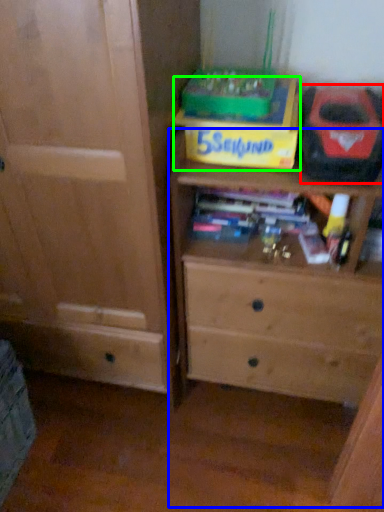
Question: Based on their relative distances, which object is nearer to kit (highlighted by a red box)? Choose from chest of drawers (highlighted by a blue box) and cardboard box (highlighted by a green box).

Choices:
 (A) chest of drawers
 (B) cardboard box

Answer: (B)